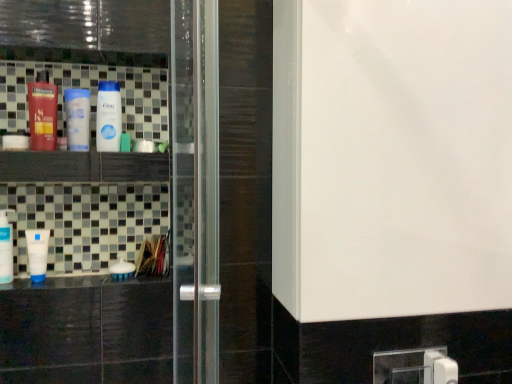
The width and height of the screenshot is (512, 384). Find the location of `free space between white glossy tube at left, arranged as the sixth bottle when viewed from the right, and white matte bottle at center, positioned as the 6th bottle in left-to-right order`. free space between white glossy tube at left, arranged as the sixth bottle when viewed from the right, and white matte bottle at center, positioned as the 6th bottle in left-to-right order is located at coordinates click(78, 278).